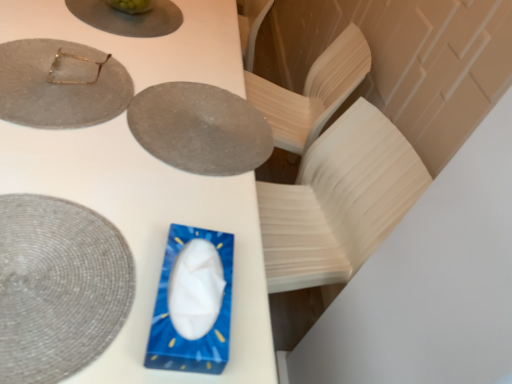
I want to click on free space in front of matte gray plate at upper center, positioned as the 1th plate in top-to-bottom order, so tap(93, 40).